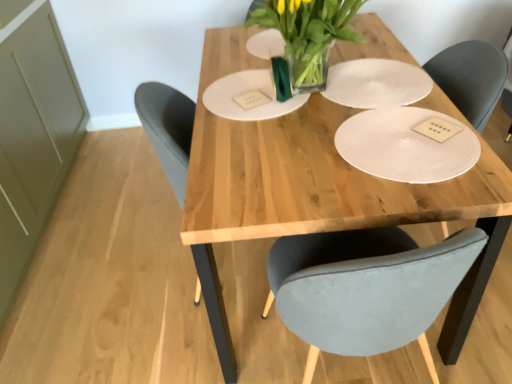
Question: Considering the relative sizes of white textured paper plate at center, placed as the second paper plate when sorted from left to right, and translucent glass vase at center in the image provided, is white textured paper plate at center, placed as the second paper plate when sorted from left to right, thinner than translucent glass vase at center?

Choices:
 (A) no
 (B) yes

Answer: (A)

Question: Considering the relative positions of white textured paper plate at center, the first paper plate in the right-to-left sequence, and translucent glass vase at center in the image provided, is white textured paper plate at center, the first paper plate in the right-to-left sequence, behind translucent glass vase at center?

Choices:
 (A) no
 (B) yes

Answer: (B)

Question: Is white textured paper plate at center, the first paper plate in the right-to-left sequence, wider than translucent glass vase at center?

Choices:
 (A) no
 (B) yes

Answer: (B)

Question: From the image's perspective, does white textured paper plate at center, the first paper plate in the right-to-left sequence, appear lower than translucent glass vase at center?

Choices:
 (A) yes
 (B) no

Answer: (A)

Question: Would you consider white textured paper plate at center, the first paper plate in the right-to-left sequence, to be distant from translucent glass vase at center?

Choices:
 (A) no
 (B) yes

Answer: (A)

Question: Can you confirm if white textured paper plate at center, placed as the second paper plate when sorted from left to right, is positioned to the right of translucent glass vase at center?

Choices:
 (A) no
 (B) yes

Answer: (B)

Question: From the image's perspective, is natural wood table at center above translucent glass vase at center?

Choices:
 (A) yes
 (B) no

Answer: (B)

Question: Considering the relative sizes of natural wood table at center and translucent glass vase at center in the image provided, is natural wood table at center taller than translucent glass vase at center?

Choices:
 (A) no
 (B) yes

Answer: (B)

Question: Can you see natural wood table at center touching translucent glass vase at center?

Choices:
 (A) yes
 (B) no

Answer: (B)

Question: Is natural wood table at center further to camera compared to translucent glass vase at center?

Choices:
 (A) yes
 (B) no

Answer: (B)

Question: Can you confirm if natural wood table at center is positioned to the left of translucent glass vase at center?

Choices:
 (A) yes
 (B) no

Answer: (B)

Question: Is the position of natural wood table at center less distant than that of translucent glass vase at center?

Choices:
 (A) no
 (B) yes

Answer: (B)

Question: Is natural wood table at center not within white matte paper plate at center, which appears as the 2th paper plate when viewed from the right?

Choices:
 (A) no
 (B) yes

Answer: (B)